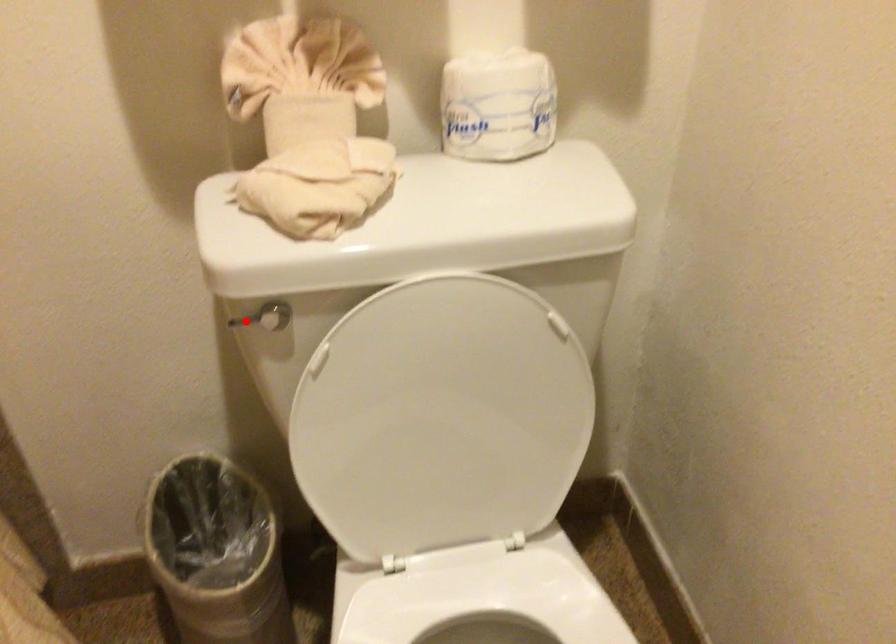
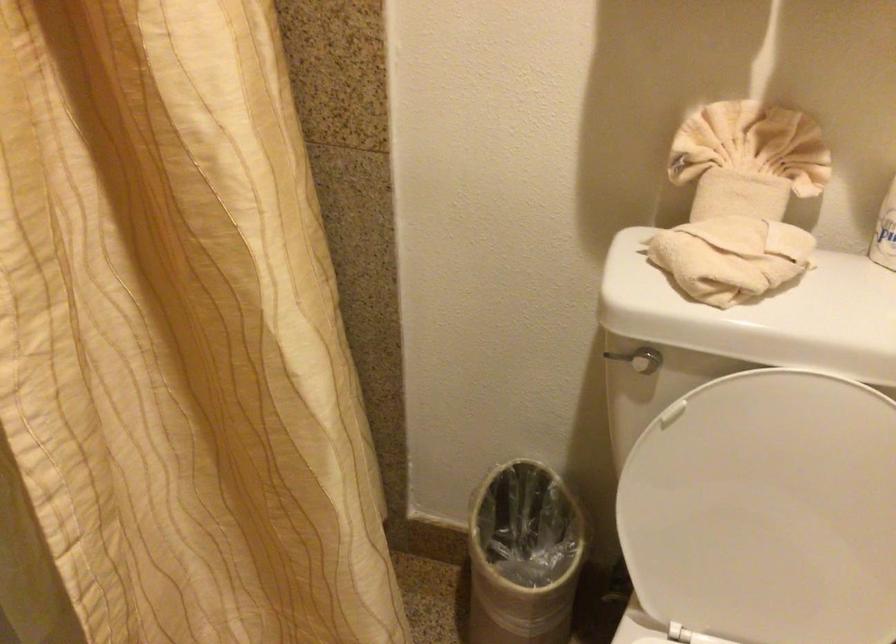
Locate, in the second image, the point that corresponds to the highlighted location in the first image.

(616, 357)